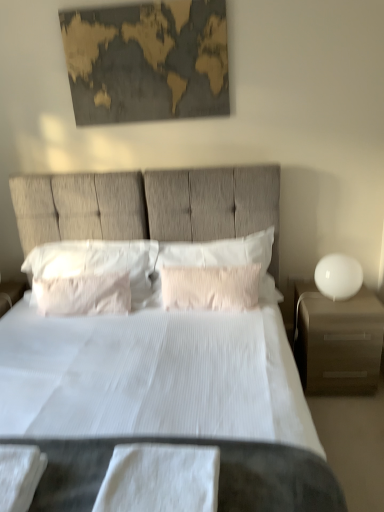
Question: Looking at their shapes, would you say matte brown nightstand at right is wider or thinner than white cotton towel at lower left, the second sheet from the right?

Choices:
 (A) wide
 (B) thin

Answer: (A)

Question: Considering their positions, is matte brown nightstand at right located in front of or behind white cotton towel at lower left, the second sheet from the right?

Choices:
 (A) behind
 (B) front

Answer: (A)

Question: Which of these objects is positioned farthest from the white glossy sphere at right?

Choices:
 (A) pink textured pillow at center, the 4th pillow viewed from the left
 (B) matte brown nightstand at right
 (C) white soft pillow at center, placed as the first pillow when sorted from left to right
 (D) white textured pillow at center, acting as the 2th pillow starting from the right
 (E) gold textured map at upper center

Answer: (E)

Question: Considering the real-world distances, which object is farthest from the white soft pillow at center, marked as the 4th pillow in a right-to-left arrangement?

Choices:
 (A) gold textured map at upper center
 (B) matte brown nightstand at right
 (C) white textured pillow at center, which is the third pillow in left-to-right order
 (D) white textured bed at center
 (E) pink textured pillow at center, positioned as the 1th pillow in right-to-left order

Answer: (B)